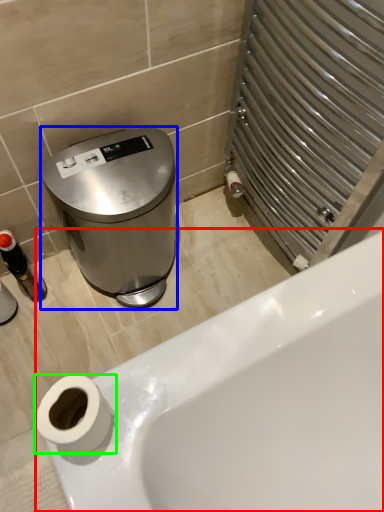
Question: Considering the real-world distances, which object is closest to bathtub (highlighted by a red box)? appliance (highlighted by a blue box) or toilet paper (highlighted by a green box).

Choices:
 (A) appliance
 (B) toilet paper

Answer: (B)